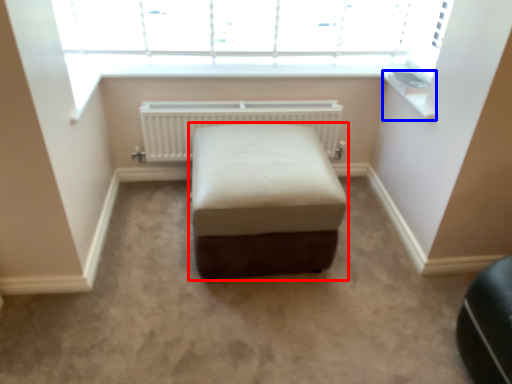
Question: Which object appears farthest to the camera in this image, furniture (highlighted by a red box) or window sill (highlighted by a blue box)?

Choices:
 (A) furniture
 (B) window sill

Answer: (B)